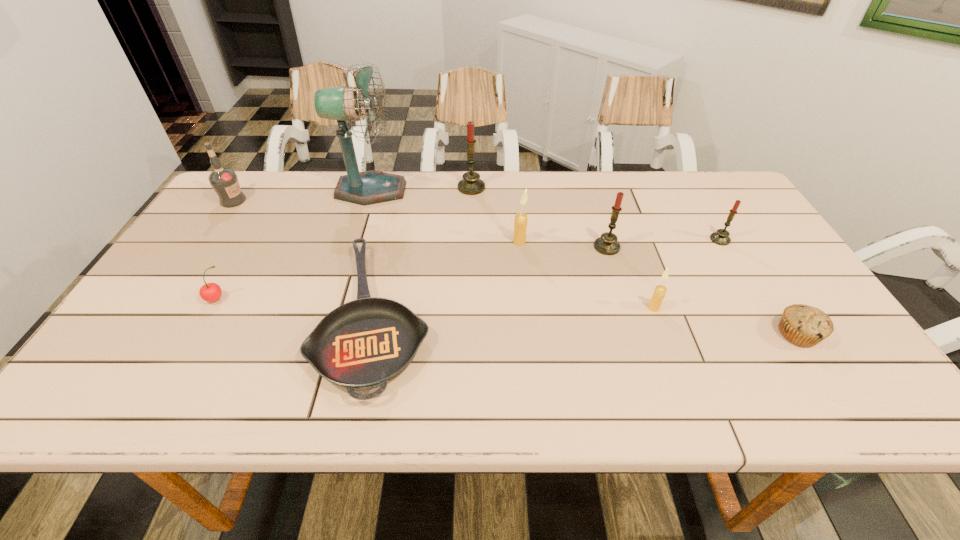
Where is `vodka at the far edge`? vodka at the far edge is located at coordinates (224, 181).

You are a GUI agent. You are given a task and a screenshot of the screen. Output one action in this format:
    pyautogui.click(x=<x>, y=<y>)
    Task: Click on the object positioned at the near edge
    The width and height of the screenshot is (960, 540).
    Given the screenshot: What is the action you would take?
    pyautogui.click(x=363, y=344)

The width and height of the screenshot is (960, 540). Find the location of `vodka that is positioned at the left edge`. vodka that is positioned at the left edge is located at coordinates (224, 181).

Locate an element on the screen. This screenshot has width=960, height=540. cherry that is at the left edge is located at coordinates (210, 292).

Identify the location of candle located in the right edge section of the desktop. Image resolution: width=960 pixels, height=540 pixels. (721, 237).

I want to click on muffin that is positioned at the right edge, so click(806, 326).

This screenshot has height=540, width=960. I want to click on object that is at the far left corner, so click(224, 181).

The height and width of the screenshot is (540, 960). Identify the location of vacant space at the far edge. (300, 188).

Where is `vacant position at the near edge of the desktop`? vacant position at the near edge of the desktop is located at coordinates (204, 394).

Identify the location of vacant space at the left edge. (249, 222).